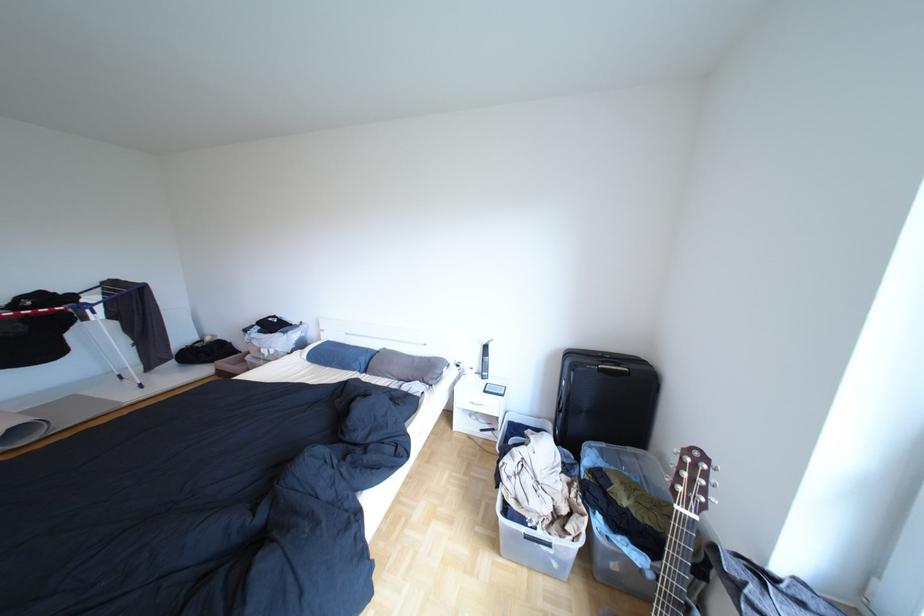
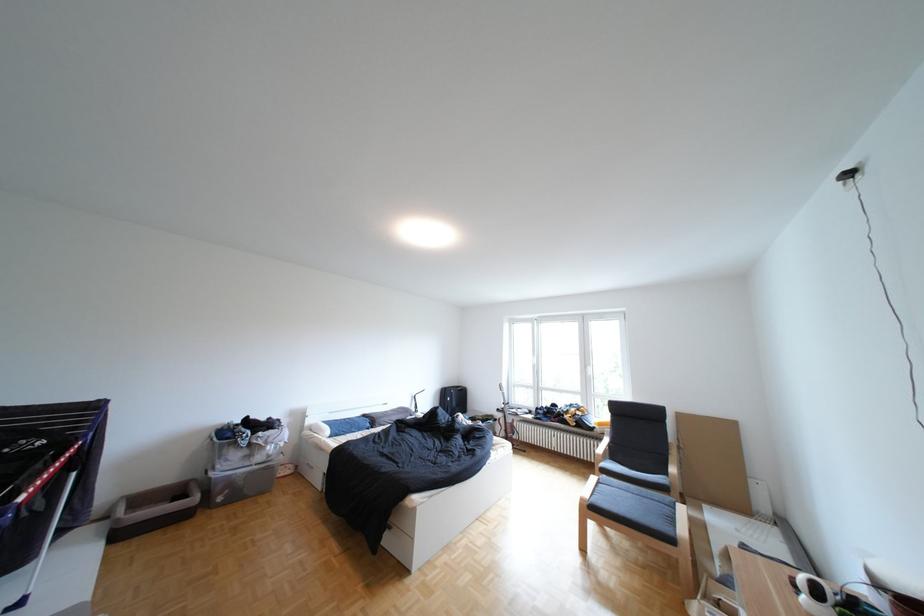
The point at [237,373] is marked in the first image. Where is the corresponding point in the second image?

(136, 536)